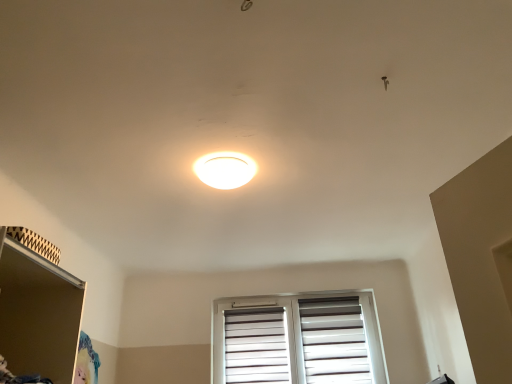
The width and height of the screenshot is (512, 384). Describe the element at coordinates (38, 313) in the screenshot. I see `matte brown shelf at lower left` at that location.

What do you see at coordinates (297, 340) in the screenshot?
I see `white matte window at center` at bounding box center [297, 340].

I want to click on matte brown shelf at lower left, so click(38, 313).

Does white matte window at center come behind white glossy ceiling light at center?

That is True.

Measure the distance between white matte window at center and white glossy ceiling light at center.

2.06 meters.

Is white matte window at center bigger than white glossy ceiling light at center?

Yes, white matte window at center is bigger than white glossy ceiling light at center.

From their relative heights in the image, would you say white matte window at center is taller or shorter than white glossy ceiling light at center?

Considering their sizes, white matte window at center has more height than white glossy ceiling light at center.

How different are the orientations of white matte window at center and matte brown shelf at lower left in degrees?

They differ by 90.8 degrees in their facing directions.

Is white matte window at center shorter than matte brown shelf at lower left?

No, white matte window at center is not shorter than matte brown shelf at lower left.

How distant is white matte window at center from matte brown shelf at lower left?

white matte window at center and matte brown shelf at lower left are 2.41 meters apart from each other.

Considering the positions of points (241, 355) and (9, 239), is point (241, 355) farther from camera compared to point (9, 239)?

Yes, it is.

Is white glossy ceiling light at center oriented away from white matte window at center?

That's not correct — white glossy ceiling light at center is not looking away from white matte window at center.

From a real-world perspective, is white glossy ceiling light at center above or below white matte window at center?

white glossy ceiling light at center is situated higher than white matte window at center in the real world.

Are white glossy ceiling light at center and white matte window at center beside each other?

They are not placed beside each other.

How different are the orientations of white glossy ceiling light at center and white matte window at center in degrees?

The facing directions of white glossy ceiling light at center and white matte window at center are 1.34 degrees apart.

From the picture: Can matte brown shelf at lower left be found inside white glossy ceiling light at center?

Definitely not — matte brown shelf at lower left is not inside white glossy ceiling light at center.

Can you see white glossy ceiling light at center touching matte brown shelf at lower left?

No, white glossy ceiling light at center is not with matte brown shelf at lower left.

Considering the sizes of white glossy ceiling light at center and matte brown shelf at lower left in the image, is white glossy ceiling light at center taller or shorter than matte brown shelf at lower left?

Clearly, white glossy ceiling light at center is shorter compared to matte brown shelf at lower left.

Does point (203, 164) appear closer or farther from the camera than point (3, 237)?

Point (203, 164) is farther from the camera than point (3, 237).

From the picture: Which of these two, matte brown shelf at lower left or white matte window at center, stands shorter?

Standing shorter between the two is matte brown shelf at lower left.

From the picture: Is matte brown shelf at lower left spatially inside white matte window at center, or outside of it?

matte brown shelf at lower left is spatially situated outside white matte window at center.

Between point (66, 296) and point (364, 356), which one is positioned in front?

The point (66, 296) is closer.

Between matte brown shelf at lower left and white matte window at center, which one appears on the left side from the viewer's perspective?

matte brown shelf at lower left is more to the left.

Which of these two, matte brown shelf at lower left or white glossy ceiling light at center, is smaller?

white glossy ceiling light at center is smaller.

Between matte brown shelf at lower left and white glossy ceiling light at center, which one has larger width?

With larger width is matte brown shelf at lower left.

Between matte brown shelf at lower left and white glossy ceiling light at center, which one has less height?

With less height is white glossy ceiling light at center.

Which point is more forward, (75, 352) or (211, 174)?

Point (75, 352)

Where is `window below the white glossy ceiling light at center (from the image's perspective)`? window below the white glossy ceiling light at center (from the image's perspective) is located at coordinates (297, 340).

Locate an element on the screen. The height and width of the screenshot is (384, 512). shelf below the white matte window at center (from a real-world perspective) is located at coordinates (38, 313).

Based on their spatial positions, is matte brown shelf at lower left or white matte window at center further from white glossy ceiling light at center?

Based on the image, white matte window at center appears to be further to white glossy ceiling light at center.

When comparing their distances from white matte window at center, does white glossy ceiling light at center or matte brown shelf at lower left seem closer?

The object closer to white matte window at center is white glossy ceiling light at center.

When comparing their distances from matte brown shelf at lower left, does white matte window at center or white glossy ceiling light at center seem closer?

white glossy ceiling light at center lies closer to matte brown shelf at lower left than the other object.

Which object lies nearer to the anchor point white glossy ceiling light at center, white matte window at center or matte brown shelf at lower left?

The object closer to white glossy ceiling light at center is matte brown shelf at lower left.

Looking at the image, which one is located closer to white matte window at center, matte brown shelf at lower left or white glossy ceiling light at center?

white glossy ceiling light at center is positioned closer to the anchor white matte window at center.

Based on their spatial positions, is white glossy ceiling light at center or white matte window at center further from matte brown shelf at lower left?

white matte window at center.

At what (x,y) coordinates should I click in order to perform the action: click on lamp positioned between matte brown shelf at lower left and white matte window at center from near to far. Please return your answer as a coordinate pair (x, y). This screenshot has height=384, width=512. Looking at the image, I should click on (225, 170).